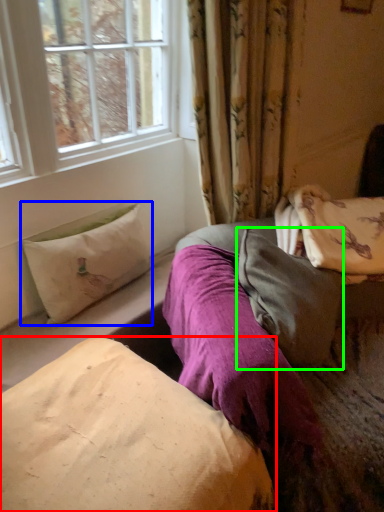
Question: Which object is the farthest from pillow (highlighted by a red box)? Choose among these: pillow (highlighted by a blue box) or pillow (highlighted by a green box).

Choices:
 (A) pillow
 (B) pillow

Answer: (A)